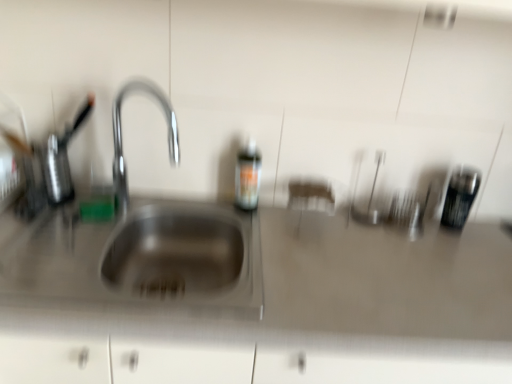
Locate an element on the screen. The image size is (512, 384). vacant space to the right of metallic black canister at right is located at coordinates (488, 231).